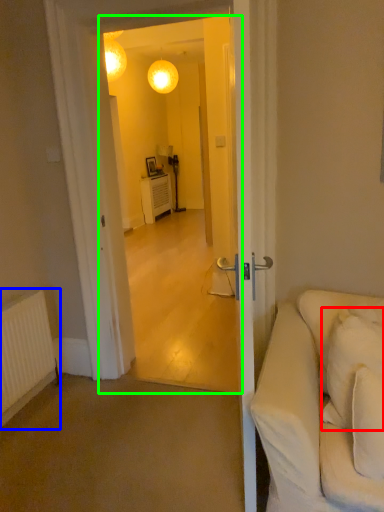
Question: Which object is positioned farthest from pillow (highlighted by a red box)? Select from radiator (highlighted by a blue box) and screen door (highlighted by a green box).

Choices:
 (A) radiator
 (B) screen door

Answer: (B)